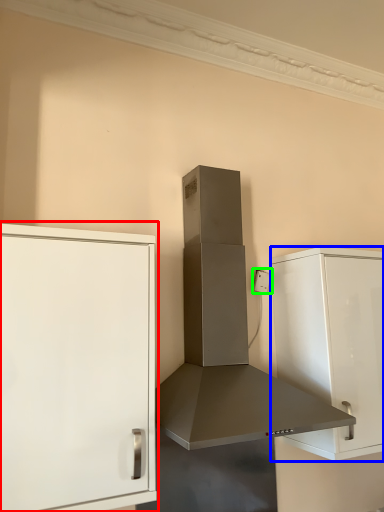
Question: Which object is the closest to the cabinetry (highlighted by a red box)? Choose among these: cabinetry (highlighted by a blue box) or electric outlet (highlighted by a green box).

Choices:
 (A) cabinetry
 (B) electric outlet

Answer: (A)